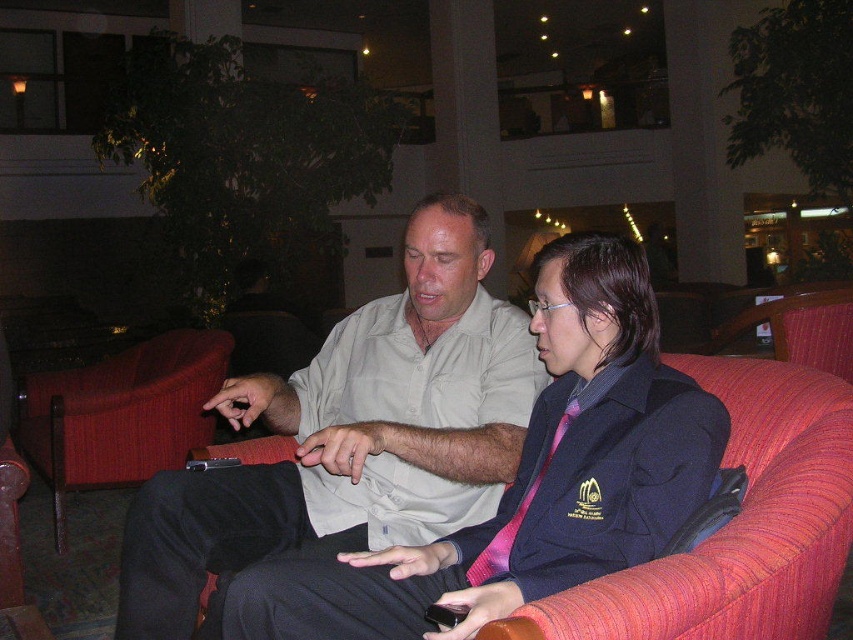
Is point (502, 627) closer to camera compared to point (572, 420)?

That is True.

Who is positioned more to the left, red fabric couch at right or pink satin tie at center?

pink satin tie at center is more to the left.

Who is more forward, (782, 573) or (509, 540)?

Point (782, 573)

Identify the location of red fabric couch at right. (737, 525).

Which is behind, point (315, 454) or point (198, 376)?

The point (198, 376) is behind.

Is point (219, 570) in front of point (140, 364)?

Yes, point (219, 570) is in front of point (140, 364).

The width and height of the screenshot is (853, 640). What do you see at coordinates (351, 435) in the screenshot?
I see `light beige shirt at center` at bounding box center [351, 435].

Locate an element on the screen. The width and height of the screenshot is (853, 640). light beige shirt at center is located at coordinates (351, 435).

How distant is light beige shirt at center from pink satin tie at center?

The distance of light beige shirt at center from pink satin tie at center is 17.66 inches.

Does light beige shirt at center appear on the left side of pink satin tie at center?

Correct, you'll find light beige shirt at center to the left of pink satin tie at center.

Between point (428, 292) and point (508, 547), which one is positioned behind?

The point (428, 292) is more distant.

Where is `light beige shirt at center`? The width and height of the screenshot is (853, 640). light beige shirt at center is located at coordinates (351, 435).